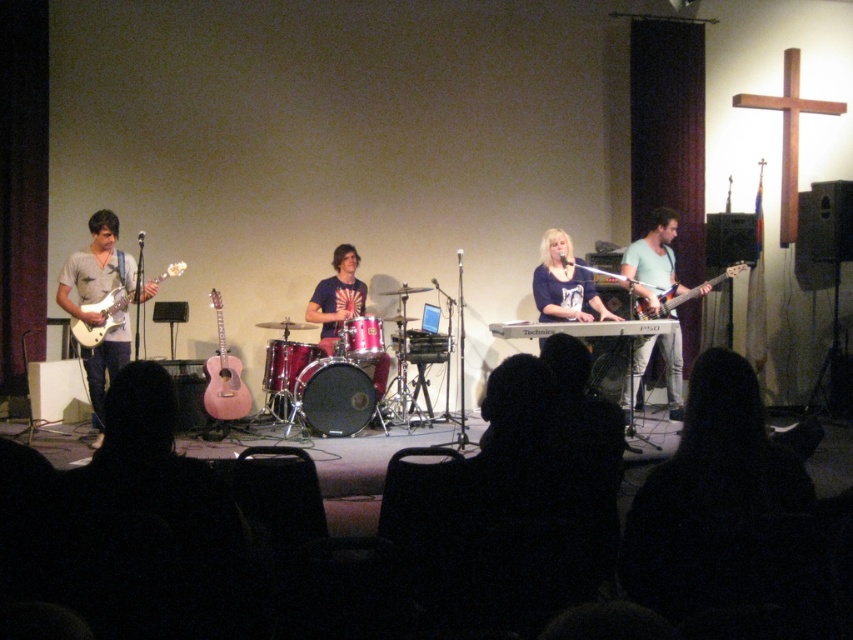
You are a photographer setting up for a live music shoot. You have a camera with a 30cm wide lens. You need to position it so that both the matte light blue shirt at right and the silver metallic keyboard at center are in frame. Which object should you align the lens width towards first to ensure both fit?

The matte light blue shirt at right is thinner than the silver metallic keyboard at center. Therefore, align the lens width towards the silver metallic keyboard at center first since it is wider, ensuring both objects fit within the 30cm lens width.

You are a stagehand holding a microphone stand that is 6 feet long. You need to place it between the matte light blue shirt at right and the black drumhead at center. Is there enough space for the microphone stand between them?

The matte light blue shirt at right and black drumhead at center are 7.42 feet apart from each other, so yes, the microphone stand that is 6 feet long can fit between them since the distance is greater than the stand length.

You are a stagehand needing to move the silver metallic keyboard at center and the metallic drum at center to the storage room. Given that the storage room entrance is narrow, allowing only one object at a time, which object should you move first to ensure the larger one fits through the entrance?

The silver metallic keyboard at center is larger than the metallic drum at center, so you should move the silver metallic keyboard at center first to ensure it fits through the narrow entrance.